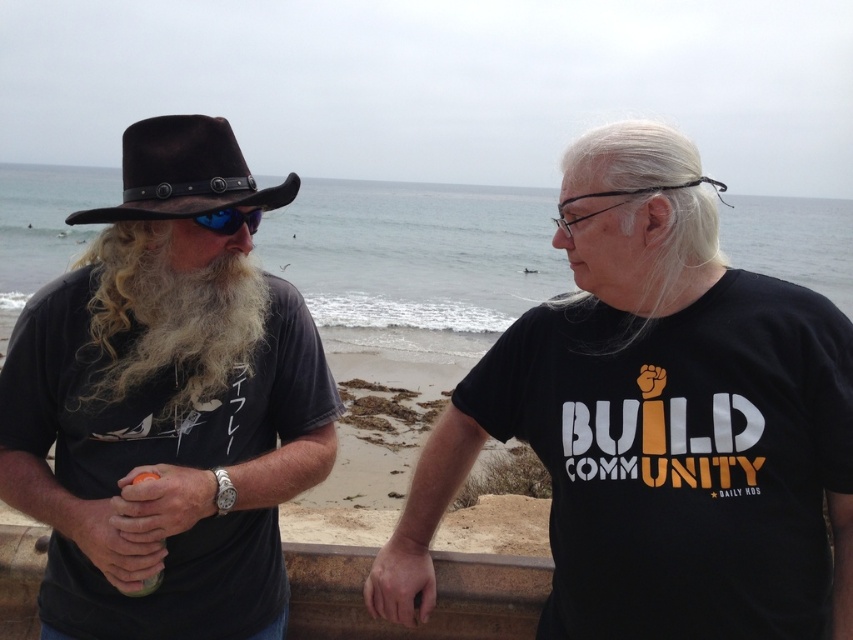
Can you confirm if black matte t-shirt at right is smaller than brown leather cowboy hat at upper left?

Yes, black matte t-shirt at right is smaller than brown leather cowboy hat at upper left.

Who is positioned more to the right, black matte t-shirt at right or brown leather cowboy hat at upper left?

black matte t-shirt at right is more to the right.

Is point (811, 419) more distant than point (181, 150)?

No, (811, 419) is in front of (181, 150).

The height and width of the screenshot is (640, 853). I want to click on black matte t-shirt at right, so click(x=682, y=458).

Can you confirm if matte black cowboy hat at left is positioned above curly blonde hair at left?

Actually, matte black cowboy hat at left is below curly blonde hair at left.

Between matte black cowboy hat at left and curly blonde hair at left, which one is positioned higher?

curly blonde hair at left is higher up.

Does point (154, 436) come in front of point (117, 282)?

No, it is not.

This screenshot has height=640, width=853. I want to click on matte black cowboy hat at left, so click(x=166, y=404).

Between point (97, 308) and point (229, 200), which one is positioned behind?

Positioned behind is point (97, 308).

Where is `curly blonde hair at left`? curly blonde hair at left is located at coordinates (167, 317).